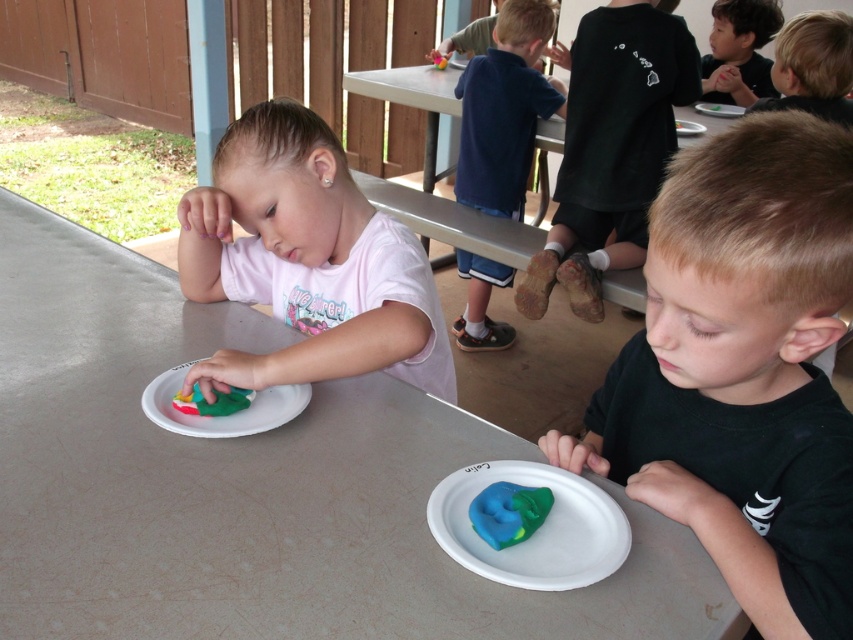
Question: Is smooth black shirt at upper right smaller than white paper plate at center?

Choices:
 (A) yes
 (B) no

Answer: (B)

Question: Observing the image, what is the correct spatial positioning of blue cotton shirt at upper center in reference to white paper plate at center?

Choices:
 (A) right
 (B) left

Answer: (B)

Question: Which of these objects is positioned closest to the blue clay at lower right?

Choices:
 (A) smooth black shirt at upper right
 (B) smooth plastic table at upper center

Answer: (B)

Question: Considering the real-world distances, which object is farthest from the smooth plastic table at upper center?

Choices:
 (A) dark gray t-shirt at upper right
 (B) green clay at left
 (C) blue clay sculpture at lower right
 (D) matte pink shirt at center

Answer: (C)

Question: Which object is positioned farthest from the blue cotton shirt at upper center?

Choices:
 (A) blue clay at lower right
 (B) smooth black shirt at upper right
 (C) green clay at left
 (D) white paper plate at center

Answer: (A)

Question: Does blue cotton shirt at upper center appear under white paper plate at upper center?

Choices:
 (A) no
 (B) yes

Answer: (B)